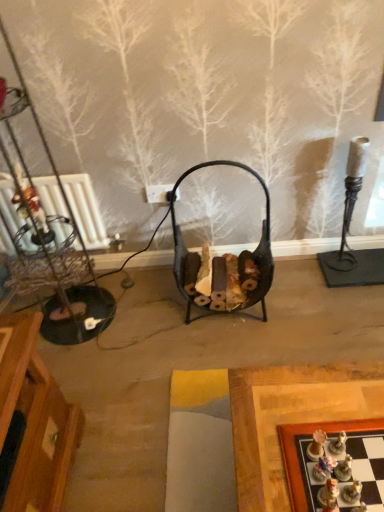
I want to click on matte plastic chess piece at lower right, so click(x=328, y=496).

What are the coordinates of `matte plastic chess piece at lower right` in the screenshot? It's located at (328, 496).

From the image's perspective, which one is positioned lower, black metal basket at center or wooden chessboard at lower right?

wooden chessboard at lower right.

Which is more to the right, black metal basket at center or wooden chessboard at lower right?

wooden chessboard at lower right is more to the right.

Considering the sizes of objects black metal basket at center and wooden chessboard at lower right in the image provided, who is bigger, black metal basket at center or wooden chessboard at lower right?

black metal basket at center.

Is black metal basket at center positioned beyond the bounds of wooden chessboard at lower right?

Indeed, black metal basket at center is completely outside wooden chessboard at lower right.

Is point (190, 310) closer or farther from the camera than point (333, 484)?

Point (190, 310) is farther from the camera than point (333, 484).

From the image's perspective, which one is positioned higher, black metal basket at center or matte plastic chess piece at lower right?

black metal basket at center appears higher in the image.

Can you confirm if black metal basket at center is thinner than matte plastic chess piece at lower right?

No, black metal basket at center is not thinner than matte plastic chess piece at lower right.

Who is bigger, black metal basket at center or matte plastic chess piece at lower right?

Bigger between the two is black metal basket at center.

From the image's perspective, would you say matte plastic chess piece at lower right is positioned over black metal basket at center?

Actually, matte plastic chess piece at lower right appears below black metal basket at center in the image.

Find the location of `toy above the black metal basket at center (from a real-world perspective)`. toy above the black metal basket at center (from a real-world perspective) is located at coordinates (328, 496).

Does matte plastic chess piece at lower right touch black metal basket at center?

No.

Between point (338, 494) and point (269, 269), which one is positioned behind?

The point (269, 269) is farther.

Is wooden chessboard at lower right looking in the opposite direction of matte plastic chess piece at lower right?

No, matte plastic chess piece at lower right is not at the back of wooden chessboard at lower right.

Considering the sizes of wooden chessboard at lower right and matte plastic chess piece at lower right in the image, is wooden chessboard at lower right taller or shorter than matte plastic chess piece at lower right?

In the image, wooden chessboard at lower right appears to be shorter than matte plastic chess piece at lower right.

Where is `board game located in front of the matte plastic chess piece at lower right`? board game located in front of the matte plastic chess piece at lower right is located at coordinates (335, 465).

From the image's perspective, which one is positioned lower, wooden chessboard at lower right or matte plastic chess piece at lower right?

wooden chessboard at lower right is shown below in the image.

Are matte plastic chess piece at lower right and wooden chessboard at lower right far apart?

Actually, matte plastic chess piece at lower right and wooden chessboard at lower right are a little close together.

Does matte plastic chess piece at lower right lie behind wooden chessboard at lower right?

Yes, matte plastic chess piece at lower right is behind wooden chessboard at lower right.

In terms of height, does matte plastic chess piece at lower right look taller or shorter compared to wooden chessboard at lower right?

Clearly, matte plastic chess piece at lower right is taller compared to wooden chessboard at lower right.

Which of these two, matte plastic chess piece at lower right or wooden chessboard at lower right, is bigger?

wooden chessboard at lower right.

Can you confirm if wooden chessboard at lower right is bigger than black metal basket at center?

Actually, wooden chessboard at lower right might be smaller than black metal basket at center.

Is wooden chessboard at lower right shorter than black metal basket at center?

Indeed, wooden chessboard at lower right has a lesser height compared to black metal basket at center.

From a real-world perspective, is wooden chessboard at lower right located higher than black metal basket at center?

Yes, from a real-world perspective, wooden chessboard at lower right is above black metal basket at center.

Which is in front, wooden chessboard at lower right or black metal basket at center?

Positioned in front is wooden chessboard at lower right.

This screenshot has height=512, width=384. I want to click on board game that appears below the black metal basket at center (from the image's perspective), so click(x=335, y=465).

In order to click on toy above the black metal basket at center (from a real-world perspective) in this screenshot , I will do `click(328, 496)`.

Estimate the real-world distances between objects in this image. Which object is further from matte plastic chess piece at lower right, black metal basket at center or wooden chessboard at lower right?

black metal basket at center.

Looking at the image, which one is located further to black metal basket at center, matte plastic chess piece at lower right or wooden chessboard at lower right?

Among the two, matte plastic chess piece at lower right is located further to black metal basket at center.

From the image, which object appears to be farther from wooden chessboard at lower right, matte plastic chess piece at lower right or black metal basket at center?

black metal basket at center lies further to wooden chessboard at lower right than the other object.

Considering their positions, is wooden chessboard at lower right positioned further to black metal basket at center than matte plastic chess piece at lower right?

matte plastic chess piece at lower right.

From the image, which object appears to be nearer to matte plastic chess piece at lower right, wooden chessboard at lower right or black metal basket at center?

Among the two, wooden chessboard at lower right is located nearer to matte plastic chess piece at lower right.

Looking at the image, which one is located closer to wooden chessboard at lower right, black metal basket at center or matte plastic chess piece at lower right?

matte plastic chess piece at lower right is closer to wooden chessboard at lower right.

The width and height of the screenshot is (384, 512). I want to click on toy between wooden chessboard at lower right and black metal basket at center from front to back, so click(328, 496).